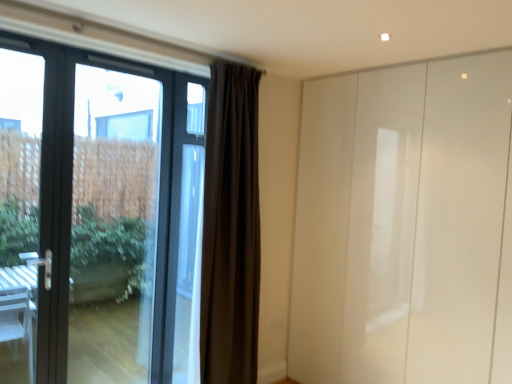
Question: Is glossy white wardrobe at right positioned in front of dark matte curtain at center?

Choices:
 (A) no
 (B) yes

Answer: (B)

Question: From the image's perspective, would you say glossy white wardrobe at right is shown under dark matte curtain at center?

Choices:
 (A) yes
 (B) no

Answer: (A)

Question: Is dark matte curtain at center completely or partially inside glossy white wardrobe at right?

Choices:
 (A) no
 (B) yes

Answer: (A)

Question: Is glossy white wardrobe at right at the left side of dark matte curtain at center?

Choices:
 (A) yes
 (B) no

Answer: (B)

Question: Is glossy white wardrobe at right to the right of dark matte curtain at center from the viewer's perspective?

Choices:
 (A) no
 (B) yes

Answer: (B)

Question: Is glossy white wardrobe at right next to dark matte curtain at center?

Choices:
 (A) yes
 (B) no

Answer: (B)

Question: Is dark matte curtain at center not near transparent glass door at left?

Choices:
 (A) no
 (B) yes

Answer: (B)

Question: Can you confirm if dark matte curtain at center is thinner than transparent glass door at left?

Choices:
 (A) no
 (B) yes

Answer: (A)

Question: Is dark matte curtain at center positioned beyond the bounds of transparent glass door at left?

Choices:
 (A) yes
 (B) no

Answer: (A)

Question: From a real-world perspective, is dark matte curtain at center positioned under transparent glass door at left based on gravity?

Choices:
 (A) yes
 (B) no

Answer: (B)

Question: Is dark matte curtain at center surrounding transparent glass door at left?

Choices:
 (A) yes
 (B) no

Answer: (B)

Question: Can you confirm if dark matte curtain at center is positioned to the left of transparent glass door at left?

Choices:
 (A) yes
 (B) no

Answer: (B)

Question: From the image's perspective, does matte black door at left appear higher than dark matte curtain at center?

Choices:
 (A) no
 (B) yes

Answer: (B)